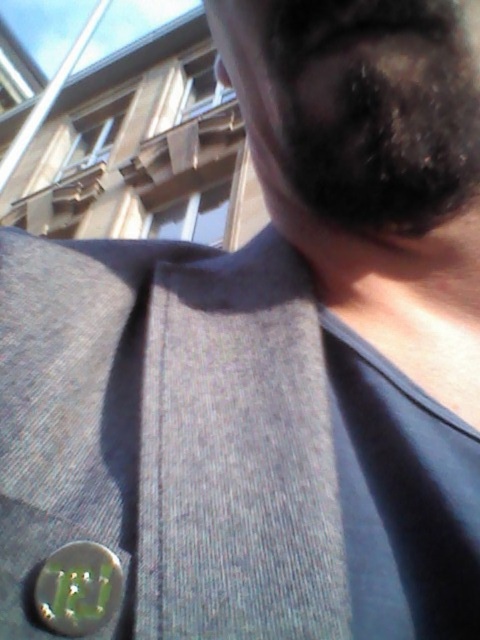
Is black fuzzy beard at upper right thinner than green metallic button at lower left?

No, black fuzzy beard at upper right is not thinner than green metallic button at lower left.

Is black fuzzy beard at upper right shorter than green metallic button at lower left?

No.

Image resolution: width=480 pixels, height=640 pixels. I want to click on black fuzzy beard at upper right, so click(x=380, y=129).